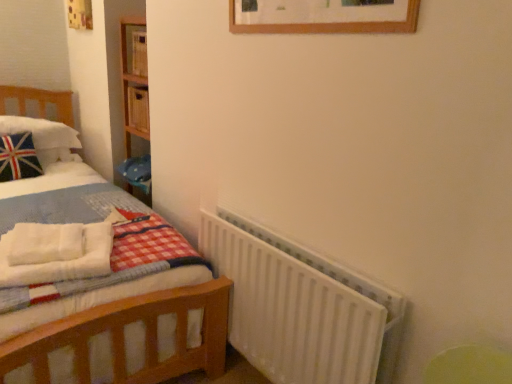
Question: Is white matte radiator at lower right far from white fluffy blanket at left?

Choices:
 (A) no
 (B) yes

Answer: (A)

Question: Is white matte radiator at lower right with white fluffy blanket at left?

Choices:
 (A) no
 (B) yes

Answer: (A)

Question: From a real-world perspective, is white matte radiator at lower right beneath white fluffy blanket at left?

Choices:
 (A) yes
 (B) no

Answer: (A)

Question: Is white fluffy blanket at left surrounded by white matte radiator at lower right?

Choices:
 (A) no
 (B) yes

Answer: (A)

Question: Is white matte radiator at lower right to the right of white fluffy blanket at left from the viewer's perspective?

Choices:
 (A) no
 (B) yes

Answer: (B)

Question: Is point (280, 362) closer or farther from the camera than point (55, 147)?

Choices:
 (A) farther
 (B) closer

Answer: (B)

Question: Looking at their shapes, would you say white matte radiator at lower right is wider or thinner than white plush pillow at left?

Choices:
 (A) thin
 (B) wide

Answer: (A)

Question: Considering the positions of white matte radiator at lower right and white plush pillow at left in the image, is white matte radiator at lower right taller or shorter than white plush pillow at left?

Choices:
 (A) tall
 (B) short

Answer: (A)

Question: Do you think white matte radiator at lower right is within white plush pillow at left, or outside of it?

Choices:
 (A) outside
 (B) inside

Answer: (A)

Question: Is white matte radiator at lower right taller or shorter than white fluffy blanket at left?

Choices:
 (A) tall
 (B) short

Answer: (A)

Question: In the image, is white matte radiator at lower right on the left side or the right side of white fluffy blanket at left?

Choices:
 (A) right
 (B) left

Answer: (A)

Question: Is white matte radiator at lower right wider or thinner than white fluffy blanket at left?

Choices:
 (A) wide
 (B) thin

Answer: (B)

Question: From a real-world perspective, is white matte radiator at lower right positioned above or below white fluffy blanket at left?

Choices:
 (A) above
 (B) below

Answer: (B)

Question: Would you say white fluffy blanket at left is to the left or to the right of white plush pillow at left in the picture?

Choices:
 (A) right
 (B) left

Answer: (A)

Question: Do you think white fluffy blanket at left is within white plush pillow at left, or outside of it?

Choices:
 (A) inside
 (B) outside

Answer: (B)